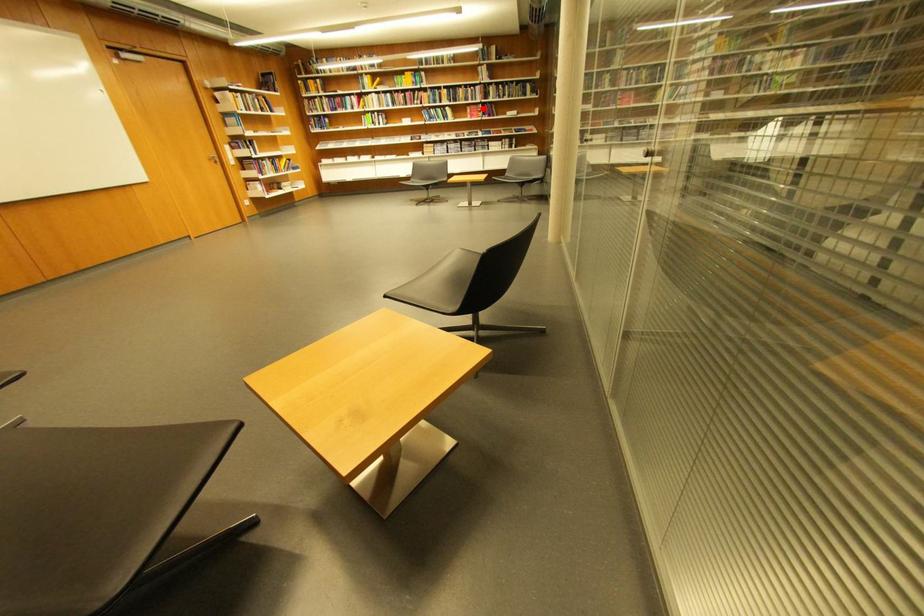
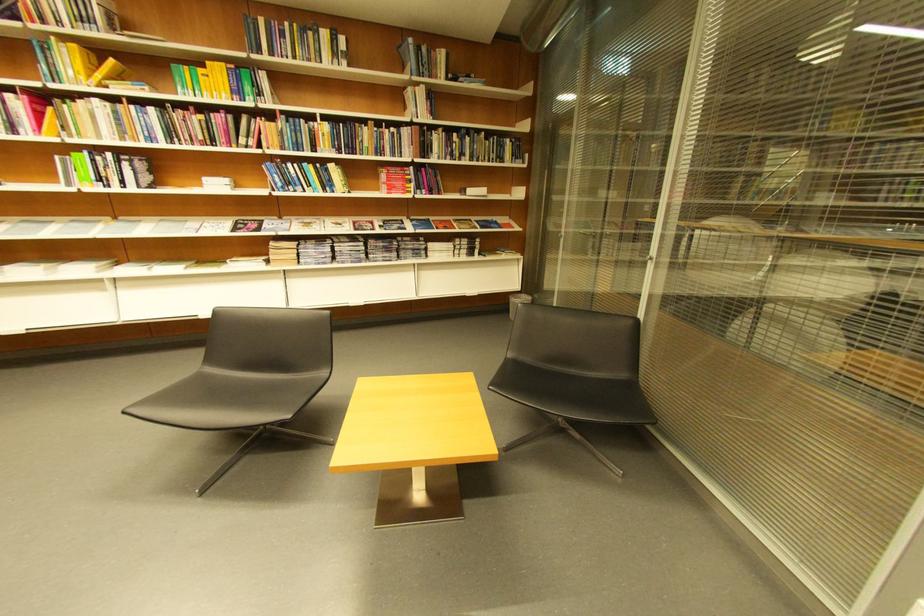
Locate, in the second image, the point that corresponds to the highlighted location in the first image.

(403, 172)